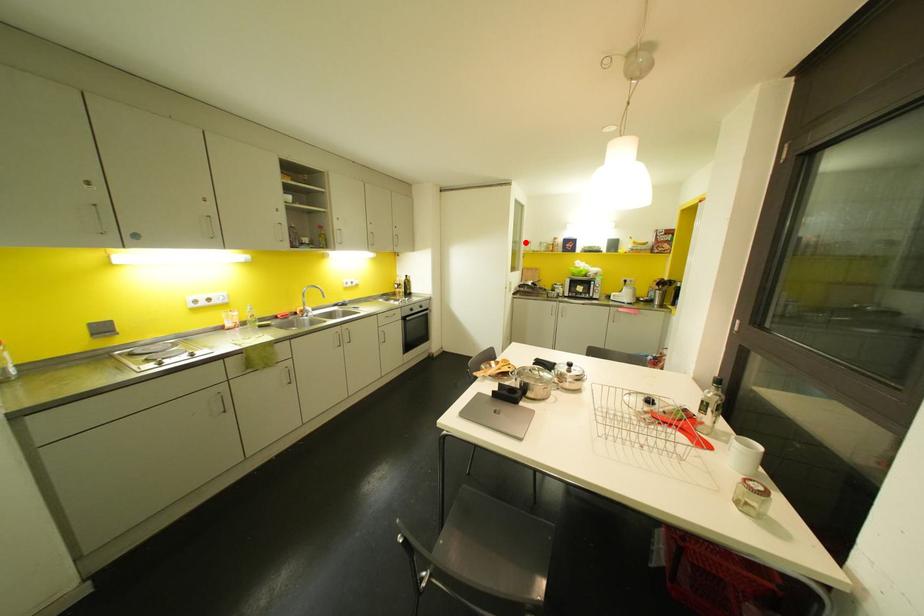
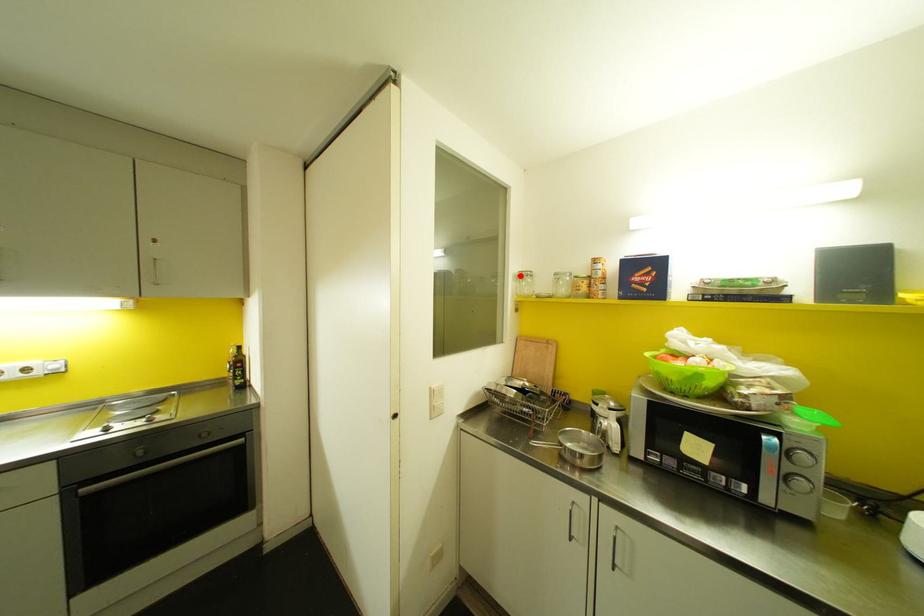
I am providing you with two images of the same scene from different viewpoints. A red point is marked on the first image and another point is marked on the second image. Do the highlighted points in image1 and image2 indicate the same real-world spot?

Yes